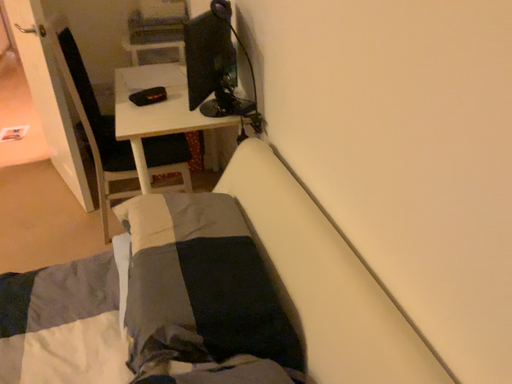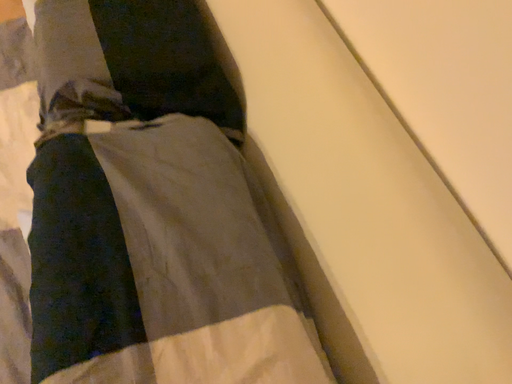
Question: How did the camera likely rotate when shooting the video?

Choices:
 (A) rotated downward
 (B) rotated upward

Answer: (A)